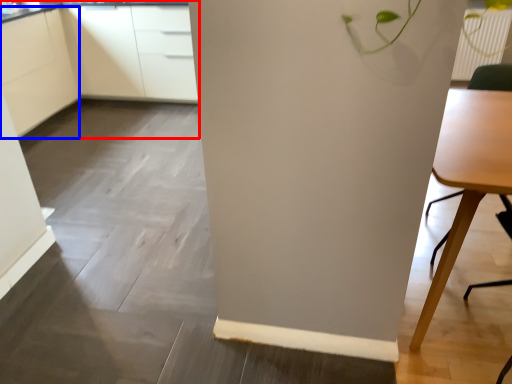
Question: Which point is further to the camera, cabinetry (highlighted by a red box) or cabinetry (highlighted by a blue box)?

Choices:
 (A) cabinetry
 (B) cabinetry

Answer: (A)